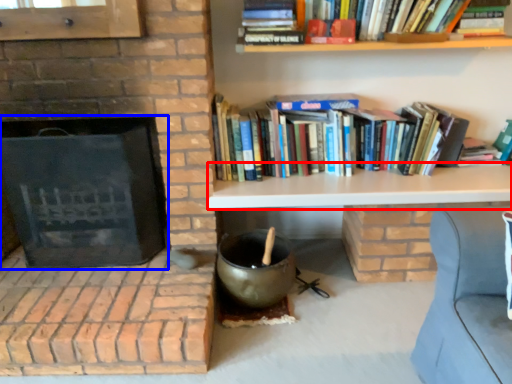
Question: Which object appears farthest to the camera in this image, table (highlighted by a red box) or fireplace (highlighted by a blue box)?

Choices:
 (A) table
 (B) fireplace

Answer: (A)